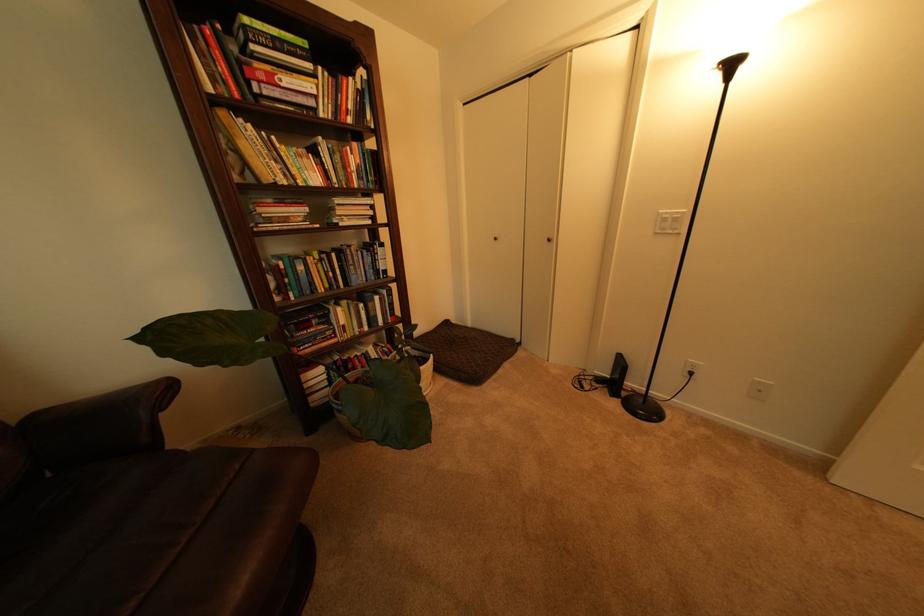
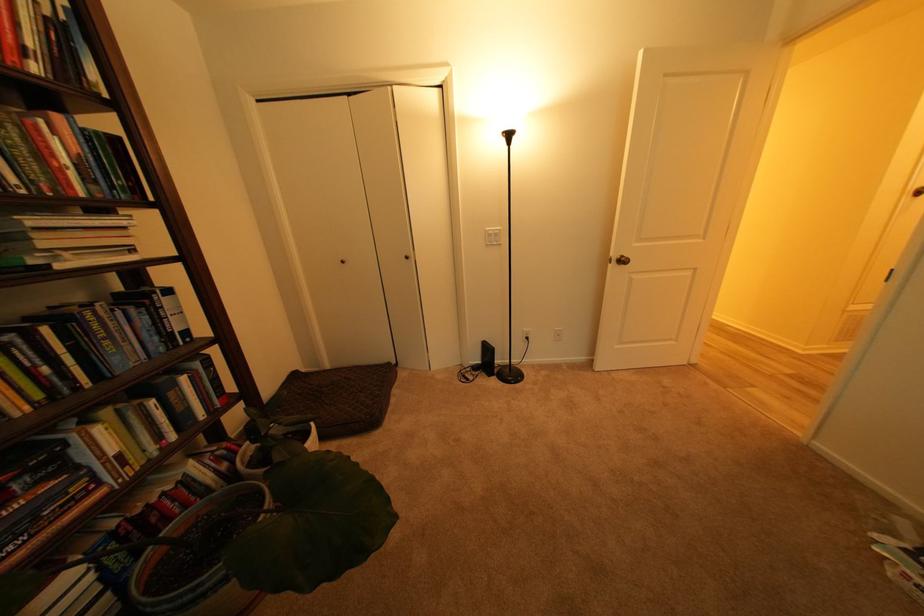
Find the pixel in the second image that matches [480,326] in the first image.

(338, 368)